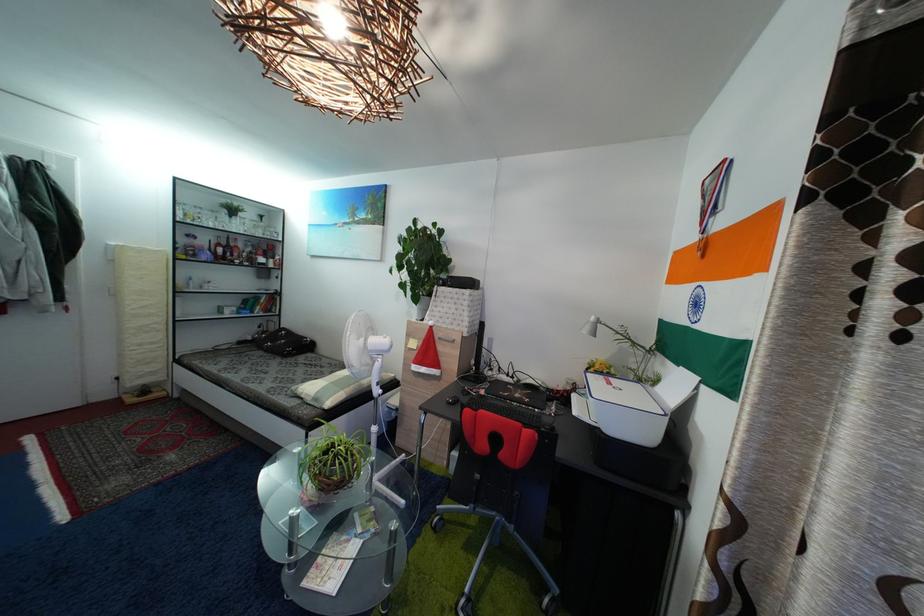
The location [453,400] corresponds to which object?

This point indicates the computer mouse.